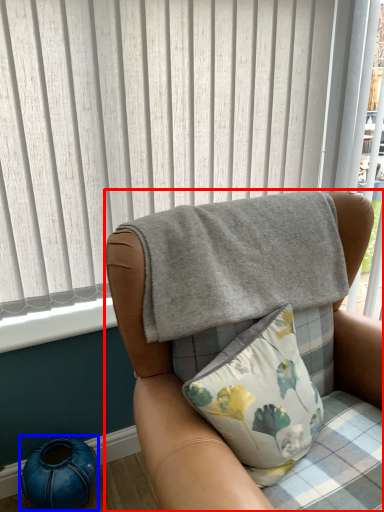
Question: Among these objects, which one is nearest to the camera, chair (highlighted by a red box) or teal (highlighted by a blue box)?

Choices:
 (A) chair
 (B) teal

Answer: (A)